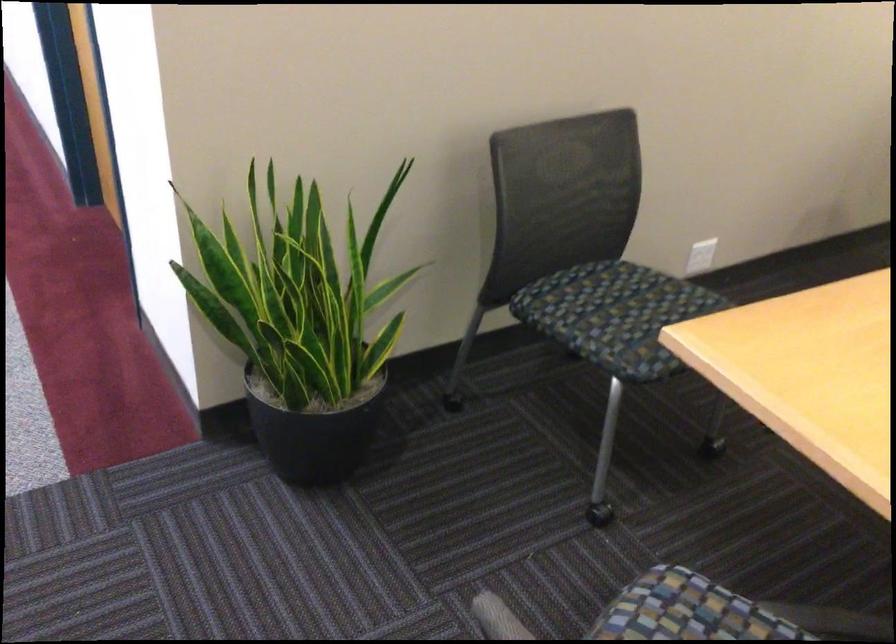
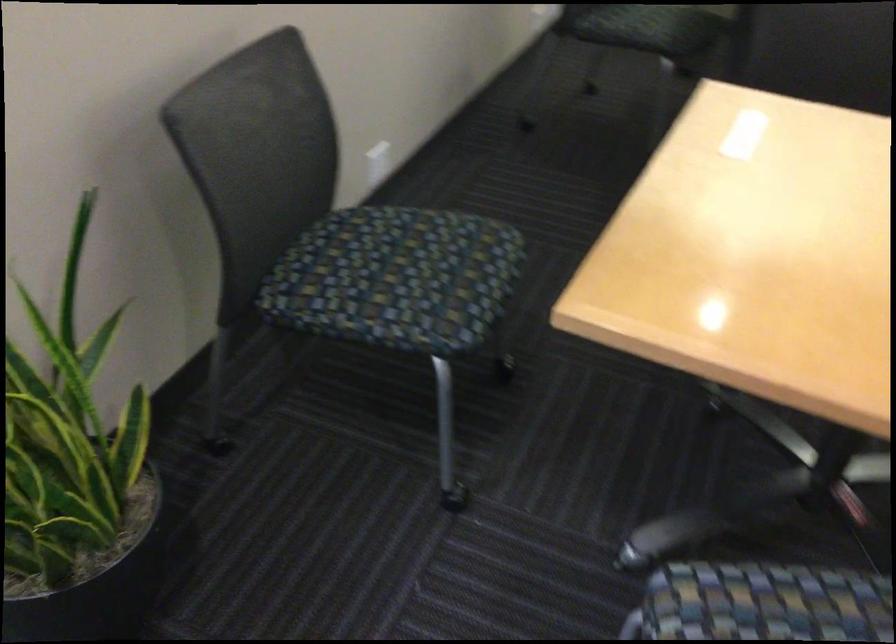
The point at (320, 415) is marked in the first image. Where is the corresponding point in the second image?

(95, 582)